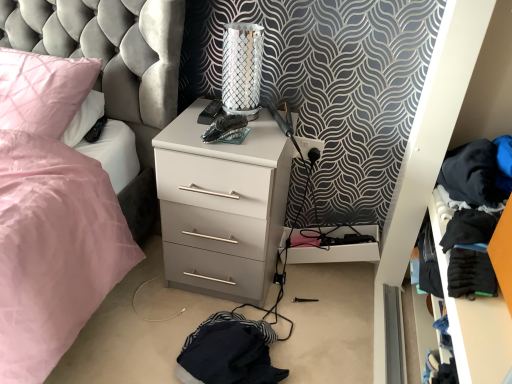
Question: Considering their positions, is black fabric clothes at right located in front of or behind silver metallic table lamp at upper center?

Choices:
 (A) behind
 (B) front

Answer: (B)

Question: Visually, is black fabric clothes at right positioned to the left or to the right of silver metallic table lamp at upper center?

Choices:
 (A) right
 (B) left

Answer: (A)

Question: Estimate the real-world distances between objects in this image. Which object is farther from the black fabric clothes at right?

Choices:
 (A) pink satin pillow at upper left
 (B) silver metallic table lamp at upper center
 (C) white matte chest of drawers at center

Answer: (A)

Question: Estimate the real-world distances between objects in this image. Which object is closer to the white matte chest of drawers at center?

Choices:
 (A) black fabric clothes at right
 (B) pink satin pillow at upper left
 (C) silver metallic table lamp at upper center

Answer: (C)